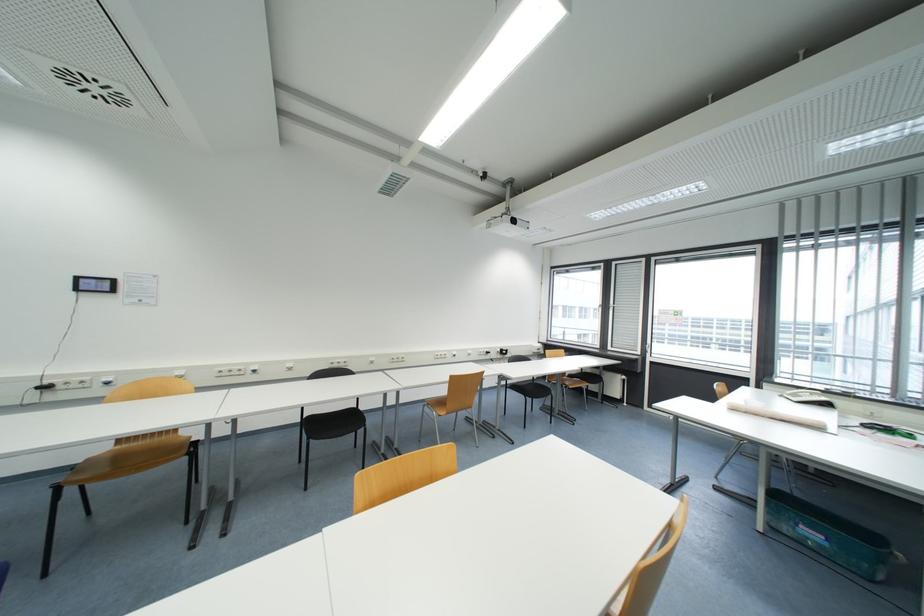
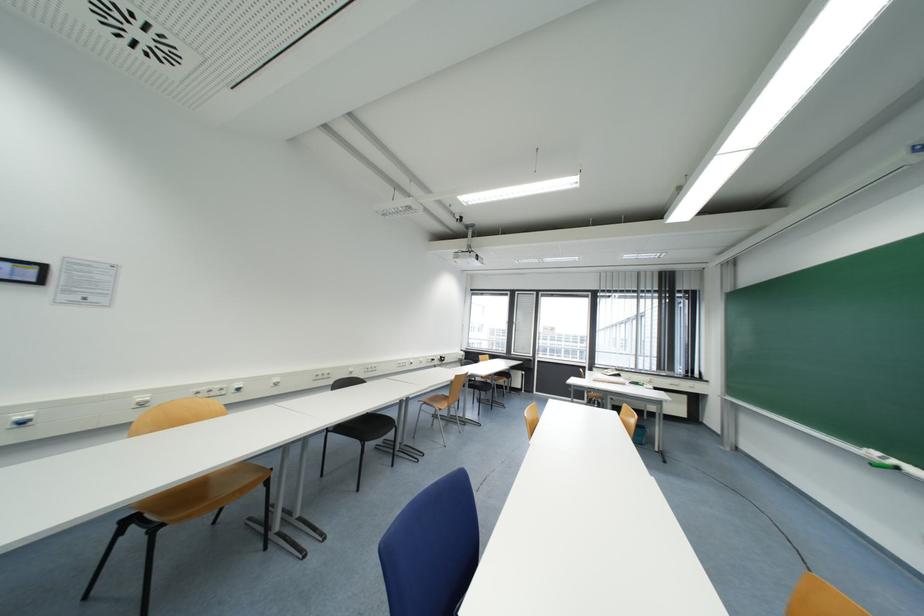
Where in the second image is the point corresponding to point (447, 415) from the first image?

(448, 408)